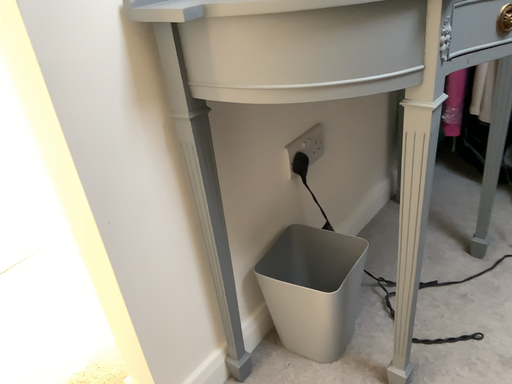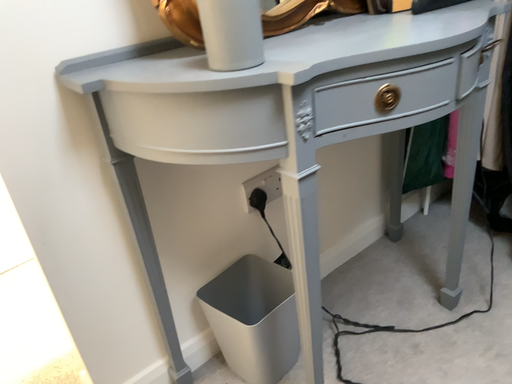
Question: How did the camera likely rotate when shooting the video?

Choices:
 (A) rotated left
 (B) rotated right

Answer: (A)